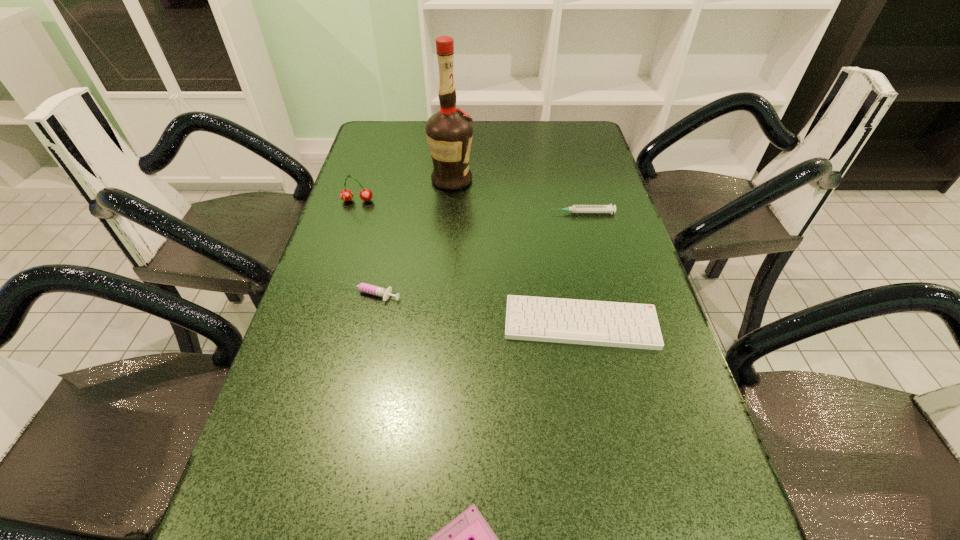
Identify the location of free space located 0.260m at the needle end of the right syringe. The height and width of the screenshot is (540, 960). (458, 213).

The height and width of the screenshot is (540, 960). I want to click on vacant space located 0.380m at the needle end of the right syringe, so click(x=416, y=213).

This screenshot has height=540, width=960. I want to click on vacant region located at the needle end of the right syringe, so (x=504, y=213).

Identify the location of free space located 0.280m on the front of the nearer syringe. This screenshot has width=960, height=540. (338, 420).

Find the location of a particular element. This screenshot has height=540, width=960. vacant space located 0.110m on the left of the computer keyboard is located at coordinates (454, 323).

Locate an element on the screen. The height and width of the screenshot is (540, 960). cherry that is positioned at the left edge is located at coordinates (346, 195).

Locate an element on the screen. syringe that is positioned at the left edge is located at coordinates (378, 291).

The height and width of the screenshot is (540, 960). I want to click on syringe that is at the right edge, so [x=575, y=208].

You are a GUI agent. You are given a task and a screenshot of the screen. Output one action in this format:
    pyautogui.click(x=<x>, y=<y>)
    Task: Click on the computer keyboard located at the right edge
    
    Given the screenshot: What is the action you would take?
    pyautogui.click(x=615, y=324)

Where is `free space at the far edge of the desktop`? This screenshot has height=540, width=960. free space at the far edge of the desktop is located at coordinates (422, 124).